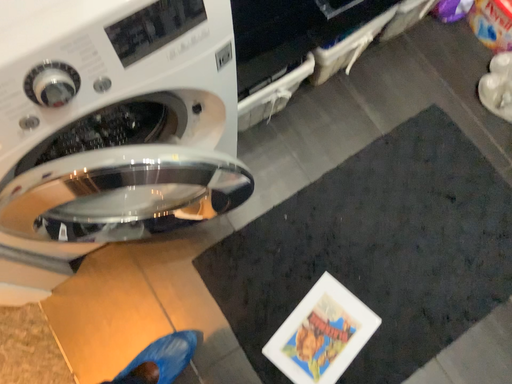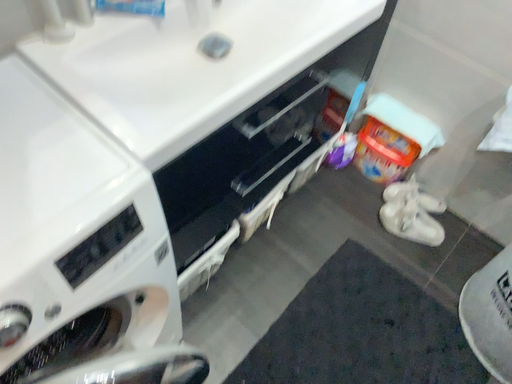
Question: How did the camera likely rotate when shooting the video?

Choices:
 (A) rotated right
 (B) rotated left

Answer: (A)